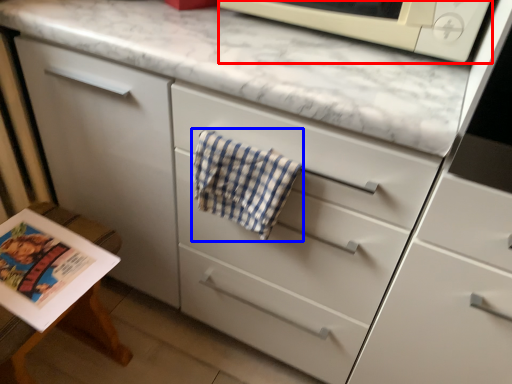
Question: Which object is closer to the camera taking this photo, microwave oven (highlighted by a red box) or beach towel (highlighted by a blue box)?

Choices:
 (A) microwave oven
 (B) beach towel

Answer: (A)